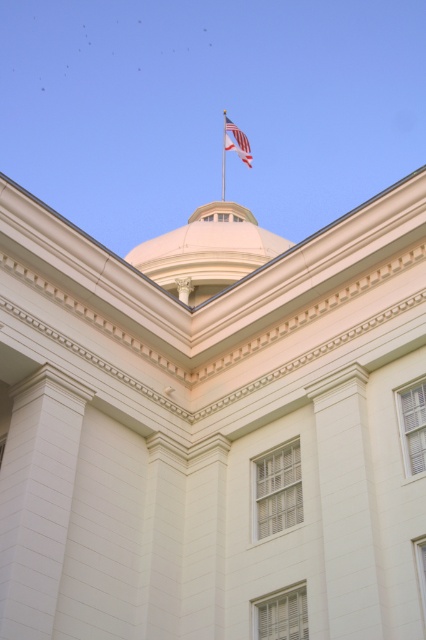
Is point (213, 244) closer to camera compared to point (241, 131)?

Yes, point (213, 244) is in front of point (241, 131).

Who is more distant from viewer, (193, 262) or (239, 152)?

The point (239, 152) is more distant.

Find the location of a particular element. Image resolution: width=426 pixels, height=640 pixels. white smooth dome at center is located at coordinates (207, 252).

At what (x,y) coordinates should I click in order to perform the action: click on white smooth dome at center. Please return your answer as a coordinate pair (x, y). The height and width of the screenshot is (640, 426). Looking at the image, I should click on (207, 252).

Find the location of a particular element. This screenshot has height=640, width=426. white smooth dome at center is located at coordinates [207, 252].

From the picture: Does white smooth dome at center appear on the right side of metallic flag pole at upper center?

Incorrect, white smooth dome at center is not on the right side of metallic flag pole at upper center.

The image size is (426, 640). In order to click on white smooth dome at center in this screenshot , I will do `click(207, 252)`.

Where is `white smooth dome at center`? This screenshot has height=640, width=426. white smooth dome at center is located at coordinates (207, 252).

Who is more distant from viewer, (233,145) or (222,109)?

The point (222,109) is behind.

The width and height of the screenshot is (426, 640). In order to click on american flag at upper center in this screenshot , I will do `click(236, 141)`.

Find the location of a particular element. american flag at upper center is located at coordinates (236, 141).